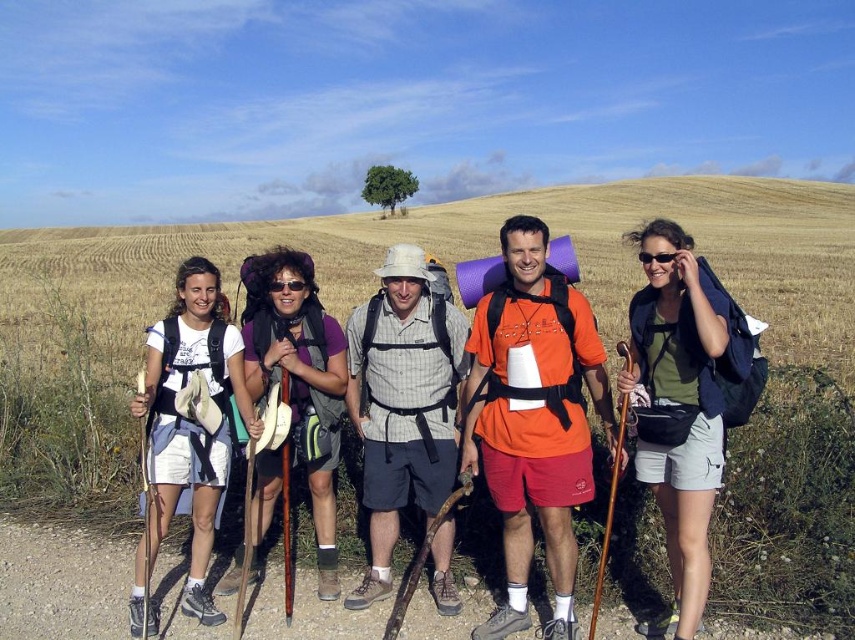
Question: Does orange fabric shirt at center have a lesser width compared to white fabric backpack at left?

Choices:
 (A) yes
 (B) no

Answer: (A)

Question: Estimate the real-world distances between objects in this image. Which object is farther from the matte purple shirt at center?

Choices:
 (A) white fabric backpack at left
 (B) orange fabric shirt at center
 (C) green fabric backpack at center
 (D) plaid fabric shirt at center

Answer: (C)

Question: Which object is positioned farthest from the green fabric backpack at center?

Choices:
 (A) orange fabric shirt at center
 (B) white fabric backpack at left
 (C) matte purple shirt at center
 (D) plaid fabric shirt at center

Answer: (B)

Question: Among these objects, which one is nearest to the camera?

Choices:
 (A) matte purple shirt at center
 (B) plaid fabric shirt at center

Answer: (B)

Question: Is green fabric backpack at center positioned in front of matte purple shirt at center?

Choices:
 (A) no
 (B) yes

Answer: (B)

Question: Is white fabric backpack at left to the right of matte purple shirt at center from the viewer's perspective?

Choices:
 (A) no
 (B) yes

Answer: (A)